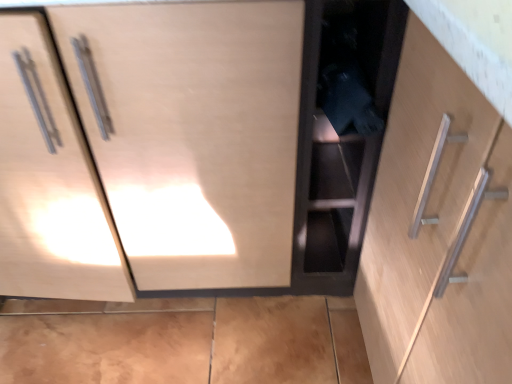
Question: In the image, is matte wood cabinet at center, which appears as the second cabinetry when viewed from the right, positioned in front of or behind black matte cabinet at center, which is the second cabinetry from left to right?

Choices:
 (A) behind
 (B) front

Answer: (B)

Question: Considering the relative positions of matte wood cabinet at center, the 1th cabinetry when ordered from left to right, and black matte cabinet at center, which is the 1th cabinetry from right to left, in the image provided, is matte wood cabinet at center, the 1th cabinetry when ordered from left to right, to the left or to the right of black matte cabinet at center, which is the 1th cabinetry from right to left,?

Choices:
 (A) left
 (B) right

Answer: (A)

Question: From a real-world perspective, is matte wood cabinet at center, the 1th cabinetry when ordered from left to right, above or below black matte cabinet at center, which is the 1th cabinetry from right to left?

Choices:
 (A) below
 (B) above

Answer: (B)

Question: Considering the relative positions of black matte cabinet at center, which is the 1th cabinetry from right to left, and matte wood cabinet at center, which appears as the second cabinetry when viewed from the right, in the image provided, is black matte cabinet at center, which is the 1th cabinetry from right to left, to the left or to the right of matte wood cabinet at center, which appears as the second cabinetry when viewed from the right,?

Choices:
 (A) left
 (B) right

Answer: (B)

Question: Does point (367, 6) appear closer or farther from the camera than point (258, 269)?

Choices:
 (A) closer
 (B) farther

Answer: (A)

Question: From a real-world perspective, is black matte cabinet at center, which is the 1th cabinetry from right to left, positioned above or below matte wood cabinet at center, which appears as the second cabinetry when viewed from the right?

Choices:
 (A) below
 (B) above

Answer: (A)

Question: Relative to matte wood cabinet at center, which appears as the second cabinetry when viewed from the right, is black matte cabinet at center, which is the 1th cabinetry from right to left, in front or behind?

Choices:
 (A) behind
 (B) front

Answer: (A)